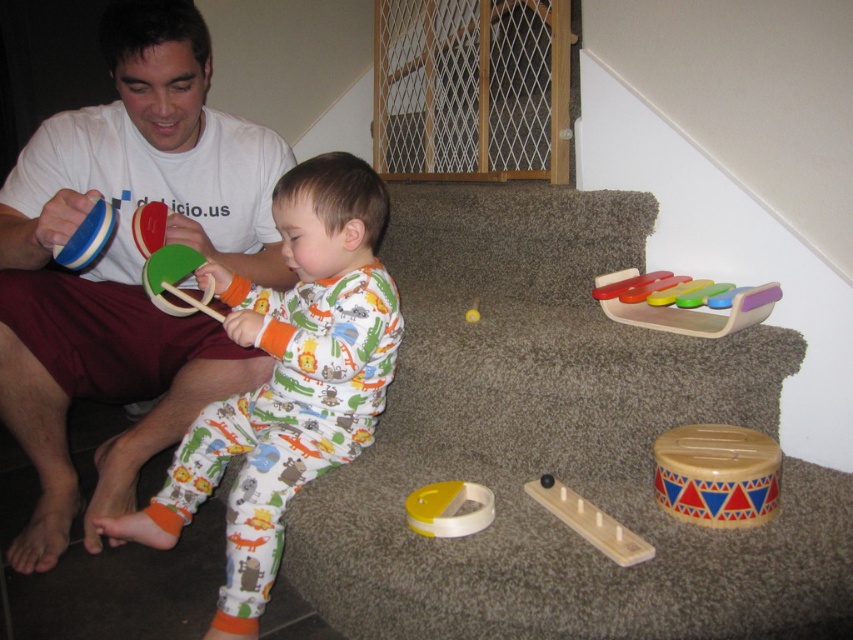
Is matte green wooden toy at center bigger than green matte ring at center?

Yes.

Does matte green wooden toy at center come behind green matte ring at center?

No, matte green wooden toy at center is in front of green matte ring at center.

Measure the distance between matte green wooden toy at center and camera.

matte green wooden toy at center is 3.95 feet from camera.

This screenshot has height=640, width=853. I want to click on matte green wooden toy at center, so click(287, 380).

Is wooden xylophone at upper right wider than green matte ring at center?

Correct, the width of wooden xylophone at upper right exceeds that of green matte ring at center.

Is point (727, 323) less distant than point (170, 259)?

Yes.

The image size is (853, 640). In order to click on wooden xylophone at upper right in this screenshot , I will do `click(697, 314)`.

Can you confirm if wooden drum at lower right is wider than yellow matte ring at center?

Correct, the width of wooden drum at lower right exceeds that of yellow matte ring at center.

Can you confirm if wooden drum at lower right is positioned below yellow matte ring at center?

Incorrect, wooden drum at lower right is not positioned below yellow matte ring at center.

Locate an element on the screen. The height and width of the screenshot is (640, 853). wooden drum at lower right is located at coordinates (717, 474).

At what (x,y) coordinates should I click in order to perform the action: click on wooden drum at lower right. Please return your answer as a coordinate pair (x, y). This screenshot has width=853, height=640. Looking at the image, I should click on (717, 474).